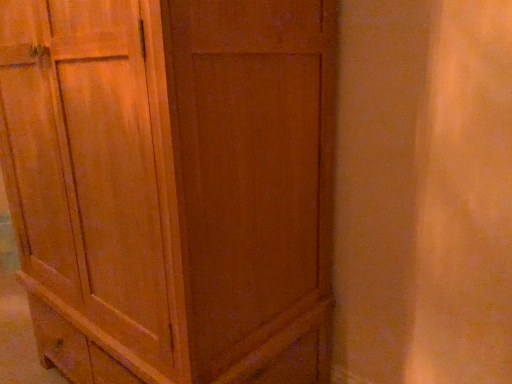
This screenshot has height=384, width=512. What do you see at coordinates (173, 185) in the screenshot?
I see `matte wood cupboard at center` at bounding box center [173, 185].

Measure the distance between matte wood cupboard at center and camera.

matte wood cupboard at center is 28.57 inches from camera.

At what (x,y) coordinates should I click in order to perform the action: click on matte wood cupboard at center. Please return your answer as a coordinate pair (x, y). Looking at the image, I should click on (173, 185).

Identify the location of matte wood cupboard at center. (173, 185).